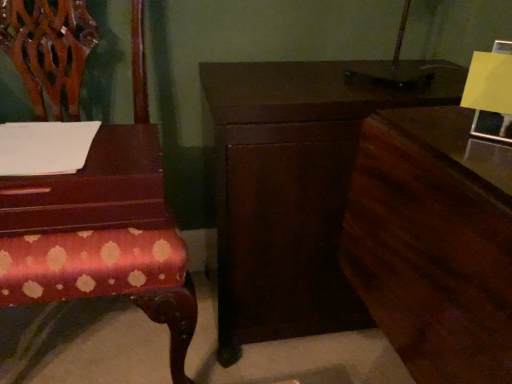
Question: Is polished wood chair at left turned away from dark wood nightstand at center?

Choices:
 (A) yes
 (B) no

Answer: (B)

Question: Is polished wood chair at left to the left of dark wood nightstand at center from the viewer's perspective?

Choices:
 (A) yes
 (B) no

Answer: (A)

Question: Considering the relative sizes of polished wood chair at left and dark wood nightstand at center in the image provided, is polished wood chair at left thinner than dark wood nightstand at center?

Choices:
 (A) yes
 (B) no

Answer: (B)

Question: Does polished wood chair at left have a smaller size compared to dark wood nightstand at center?

Choices:
 (A) no
 (B) yes

Answer: (A)

Question: Is polished wood chair at left wider than dark wood nightstand at center?

Choices:
 (A) no
 (B) yes

Answer: (B)

Question: Which is correct: dark wood nightstand at center is inside mahogany wood table at left, or outside of it?

Choices:
 (A) inside
 (B) outside

Answer: (B)

Question: Based on their positions, is dark wood nightstand at center located to the left or right of mahogany wood table at left?

Choices:
 (A) right
 (B) left

Answer: (A)

Question: From the image's perspective, is dark wood nightstand at center above or below mahogany wood table at left?

Choices:
 (A) above
 (B) below

Answer: (B)

Question: From a real-world perspective, is dark wood nightstand at center physically located above or below mahogany wood table at left?

Choices:
 (A) below
 (B) above

Answer: (A)

Question: In terms of size, does dark wood dresser at right appear bigger or smaller than dark wood nightstand at center?

Choices:
 (A) big
 (B) small

Answer: (B)

Question: Is point (437, 365) closer or farther from the camera than point (298, 289)?

Choices:
 (A) closer
 (B) farther

Answer: (A)

Question: Visually, is dark wood dresser at right positioned to the left or to the right of dark wood nightstand at center?

Choices:
 (A) left
 (B) right

Answer: (B)

Question: From a real-world perspective, relative to dark wood nightstand at center, is dark wood dresser at right vertically above or below?

Choices:
 (A) below
 (B) above

Answer: (B)

Question: Relative to polished wood chair at left, is dark wood nightstand at center in front or behind?

Choices:
 (A) behind
 (B) front

Answer: (A)

Question: Visually, is dark wood nightstand at center positioned to the left or to the right of polished wood chair at left?

Choices:
 (A) left
 (B) right

Answer: (B)